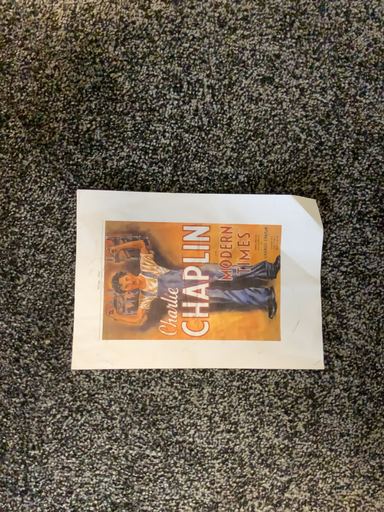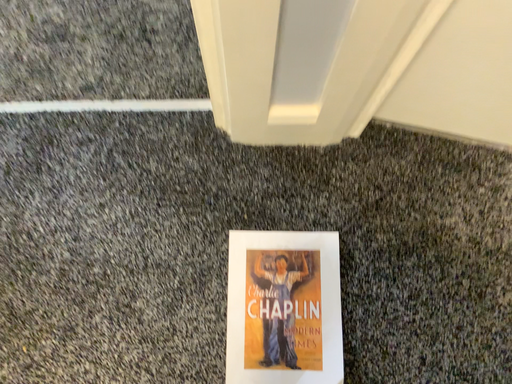
Question: Which way did the camera rotate in the video?

Choices:
 (A) rotated upward
 (B) rotated downward

Answer: (A)